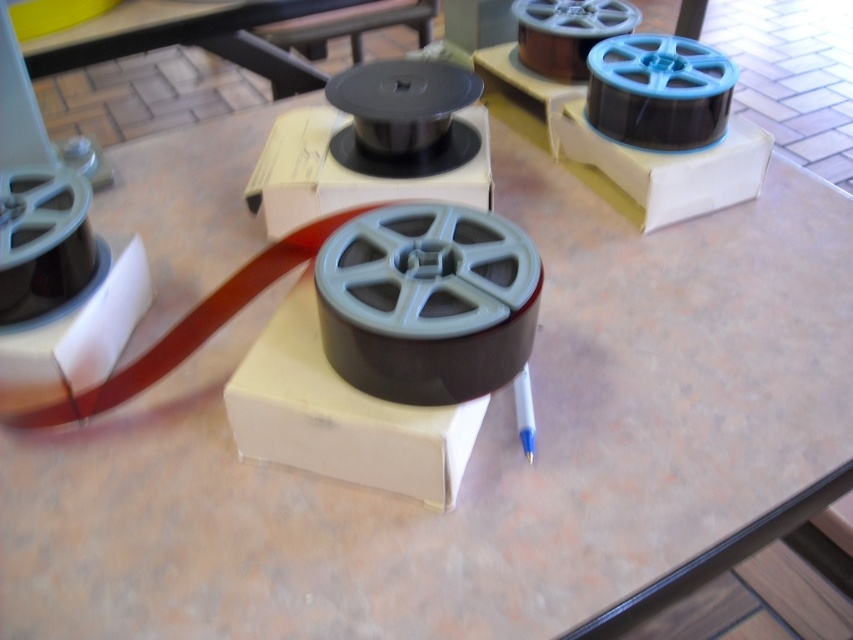
Between point (492, 268) and point (416, 88), which one is positioned in front?

Point (492, 268) is more forward.

Is gray matte film reel at center positioned at the back of matte black spool at center?

No, it is not.

What do you see at coordinates (427, 301) in the screenshot? This screenshot has height=640, width=853. I see `gray matte film reel at center` at bounding box center [427, 301].

Find the location of `gray matte film reel at center`. gray matte film reel at center is located at coordinates (427, 301).

Looking at this image, which of these two, blue plastic spool at upper right or matte black spool at center, stands taller?

matte black spool at center

Does blue plastic spool at upper right have a smaller size compared to matte black spool at center?

Yes, blue plastic spool at upper right is smaller than matte black spool at center.

Find the location of a particular element. blue plastic spool at upper right is located at coordinates (659, 92).

The image size is (853, 640). What are the coordinates of `blue plastic spool at upper right` in the screenshot? It's located at (659, 92).

This screenshot has height=640, width=853. I want to click on gray matte film reel at center, so click(x=427, y=301).

How distant is gray matte film reel at center from blue plastic spool at upper right?

gray matte film reel at center is 19.50 inches from blue plastic spool at upper right.

Which is behind, point (407, 262) or point (653, 102)?

The point (653, 102) is more distant.

The height and width of the screenshot is (640, 853). Find the location of `gray matte film reel at center`. gray matte film reel at center is located at coordinates (427, 301).